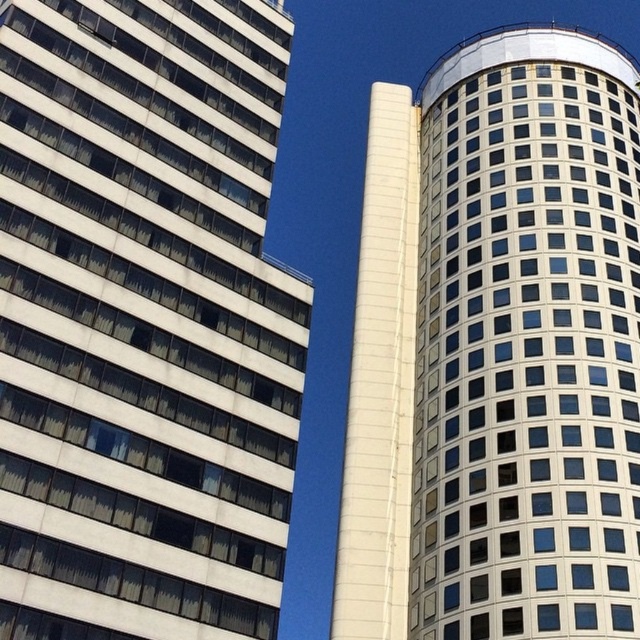
You are standing at point (144,321) in the image. Which building do you see in front of you?

The white glass building at left is located at point (144,321), so you see the white glass building at left in front of you.